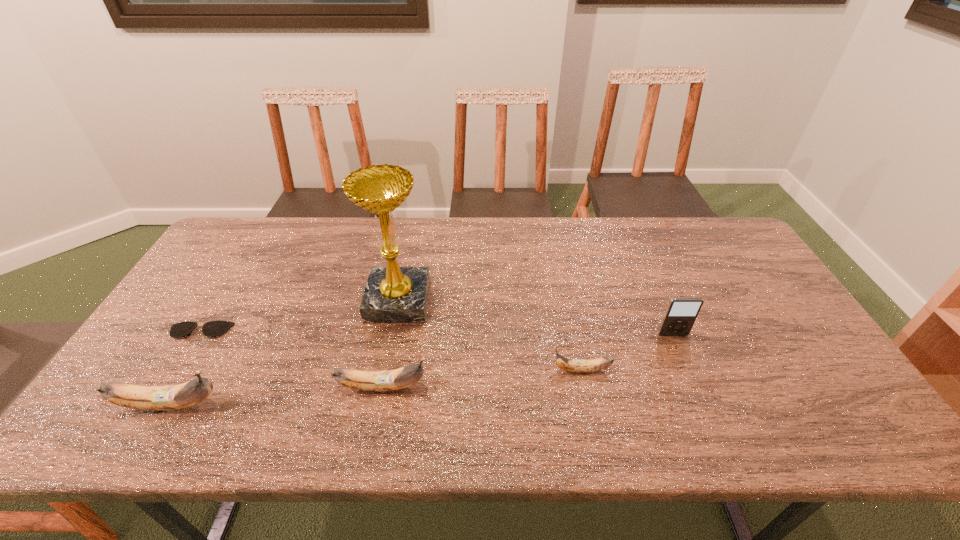
You are a GUI agent. You are given a task and a screenshot of the screen. Output one action in this format:
    pyautogui.click(x=<x>, y=<y>)
    Task: Click on the free space at the left edge
    
    Given the screenshot: What is the action you would take?
    pyautogui.click(x=179, y=369)

Find the location of a particular element. Image resolution: width=960 pixels, height=540 pixels. vacant region at the far right corner of the desktop is located at coordinates (716, 224).

I want to click on vacant point located between the fifth object from left to right and the rightmost object, so click(627, 353).

Identify the location of free space between the second shortest banana and the spectacles. This screenshot has height=540, width=960. (291, 359).

Where is `free spot between the award and the iPod`? free spot between the award and the iPod is located at coordinates (536, 318).

Locate an element on the screen. This screenshot has width=960, height=540. vacant space that is in between the leftmost banana and the second banana from right to left is located at coordinates (276, 395).

Find the location of a particular element. The height and width of the screenshot is (540, 960). free spot between the spectacles and the rightmost banana is located at coordinates pos(391,350).

Find the location of a particular element. The width and height of the screenshot is (960, 540). empty location between the second shortest object and the shortest object is located at coordinates (391, 350).

Identify the location of free spot between the shortest object and the leftmost banana. (185, 368).

You are a GUI agent. You are given a task and a screenshot of the screen. Output one action in this format:
    pyautogui.click(x=<x>, y=<y>)
    Task: Click on the closest object to the second banana from right to left
    
    Given the screenshot: What is the action you would take?
    pyautogui.click(x=393, y=294)